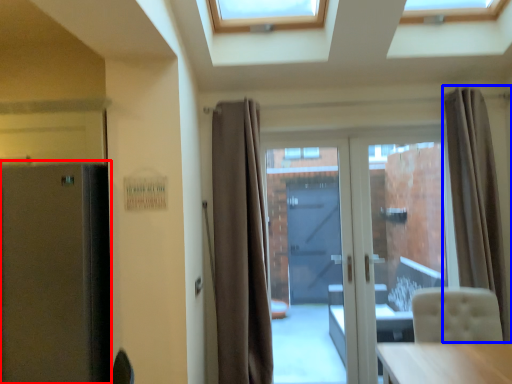
Question: Which object appears closest to the camera in this image, fridge (highlighted by a red box) or curtain (highlighted by a blue box)?

Choices:
 (A) fridge
 (B) curtain

Answer: (A)